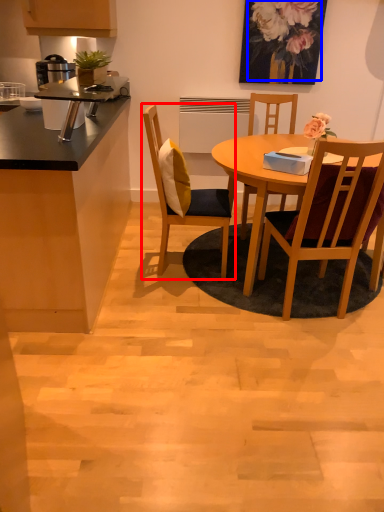
Question: Which of the following is the farthest to the observer, chair (highlighted by a red box) or floral arrangement (highlighted by a blue box)?

Choices:
 (A) chair
 (B) floral arrangement

Answer: (B)